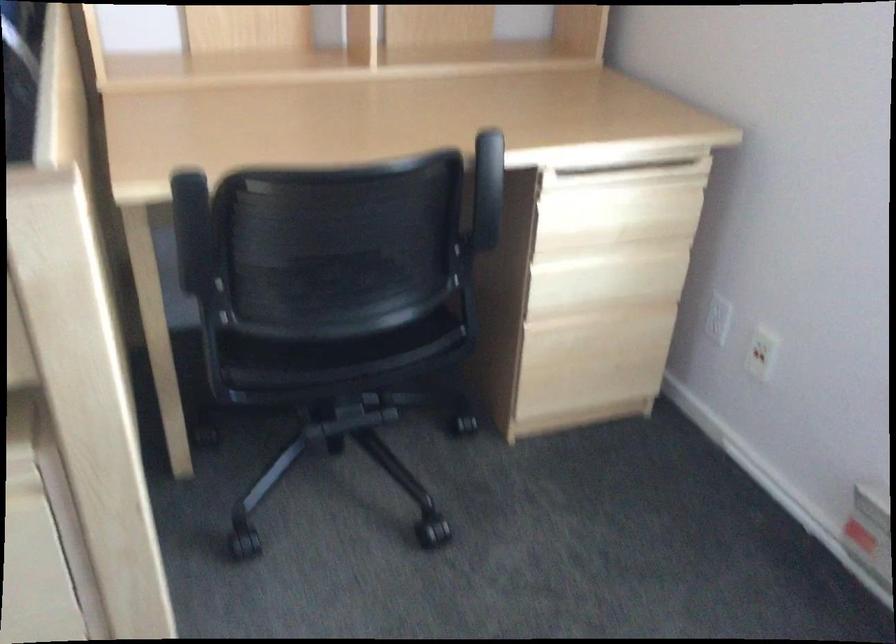
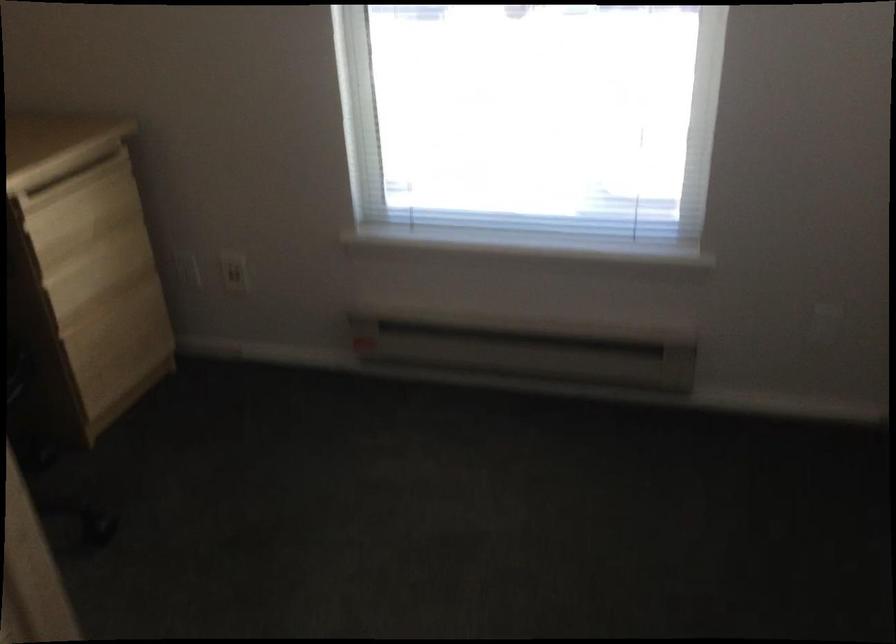
Question: The images are taken continuously from a first-person perspective. In which direction is your viewpoint rotating?

Choices:
 (A) Left
 (B) Right
 (C) Up
 (D) Down

Answer: (B)